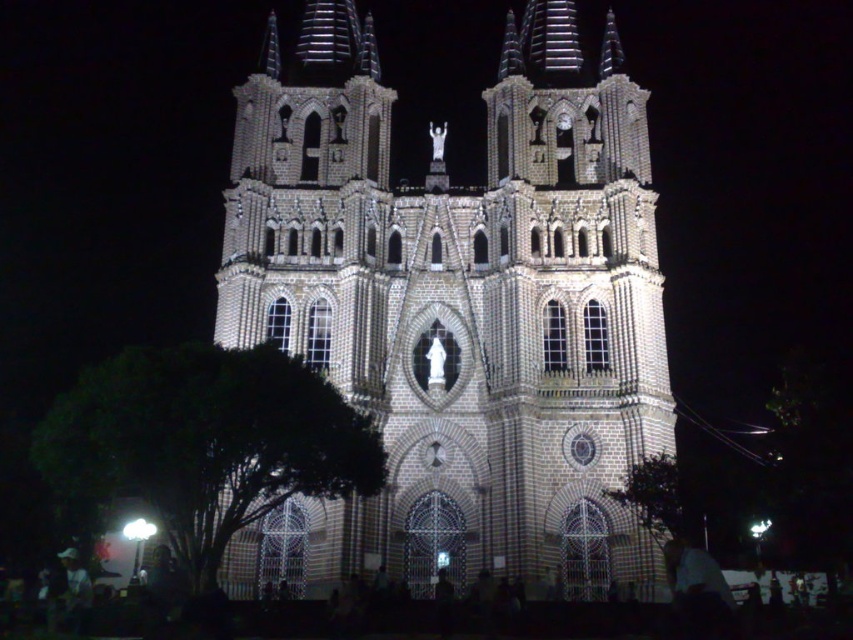
I want to click on green leafy tree at lower left, so click(206, 442).

Who is lower down, green leafy tree at lower left or green leafy tree at lower right?

green leafy tree at lower right is below.

Find the location of a particular element. The image size is (853, 640). green leafy tree at lower left is located at coordinates (206, 442).

Locate an element on the screen. Image resolution: width=853 pixels, height=640 pixels. green leafy tree at lower left is located at coordinates (206, 442).

Who is positioned more to the right, brown textured stone church at center or green leafy tree at lower left?

Positioned to the right is brown textured stone church at center.

What do you see at coordinates (456, 310) in the screenshot? I see `brown textured stone church at center` at bounding box center [456, 310].

The width and height of the screenshot is (853, 640). In order to click on brown textured stone church at center in this screenshot , I will do `click(456, 310)`.

Can you confirm if brown textured stone church at center is wider than green leafy tree at lower right?

Yes.

Does brown textured stone church at center appear under green leafy tree at lower right?

Incorrect, brown textured stone church at center is not positioned below green leafy tree at lower right.

Describe the element at coordinates (456, 310) in the screenshot. I see `brown textured stone church at center` at that location.

I want to click on brown textured stone church at center, so click(456, 310).